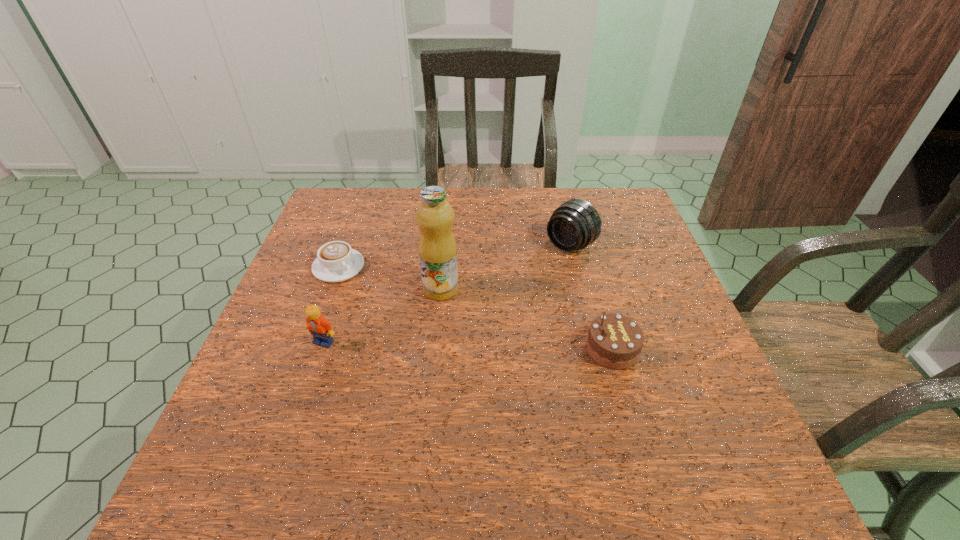
Where is `free space that is in between the Lego and the tallest object`? This screenshot has height=540, width=960. free space that is in between the Lego and the tallest object is located at coordinates (382, 315).

Locate an element on the screen. The image size is (960, 540). free point between the second shortest object and the cappuccino is located at coordinates (475, 308).

At what (x,y) coordinates should I click in order to perform the action: click on free spot between the second shortest object and the third object from right to left. Please return your answer as a coordinate pair (x, y). The width and height of the screenshot is (960, 540). Looking at the image, I should click on (526, 319).

Identify the location of unoccupied area between the tallest object and the fourth shortest object. (506, 267).

Where is `empty space between the tallest object and the cappuccino`? The width and height of the screenshot is (960, 540). empty space between the tallest object and the cappuccino is located at coordinates (390, 278).

At what (x,y) coordinates should I click in order to perform the action: click on free space between the telephoto lens and the tallest object. Please return your answer as a coordinate pair (x, y). Looking at the image, I should click on (506, 267).

Find the location of a particular element. blank region between the Lego and the second shortest object is located at coordinates (468, 346).

Identify the location of the third closest object to the chocolate cake. (320, 328).

Identify which object is located as the third nearest to the shortest object. Please provide its 2D coordinates. Your answer should be formatted as a tuple, i.e. [(x, y)], where the tuple contains the x and y coordinates of a point satisfying the conditions above.

[(575, 224)]

Where is `free spot that satisfies the following two spatial constraints: 1. on the front side of the cappuccino; 2. on the left side of the third object from right to left`? The width and height of the screenshot is (960, 540). free spot that satisfies the following two spatial constraints: 1. on the front side of the cappuccino; 2. on the left side of the third object from right to left is located at coordinates (330, 289).